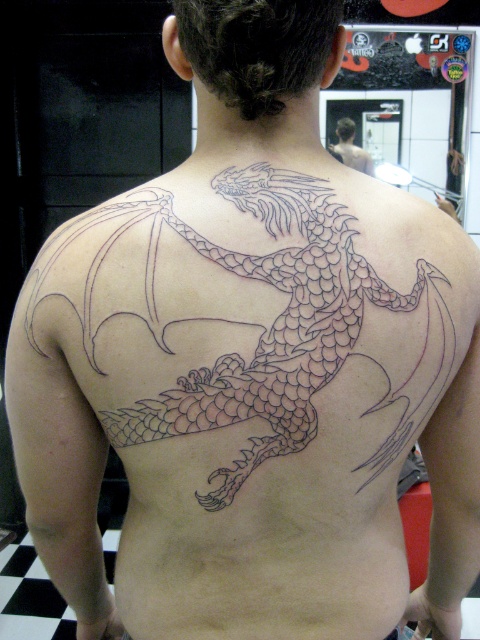
Question: Which object is closer to the camera taking this photo?

Choices:
 (A) black ink dragon at upper center
 (B) black line art dragon at center

Answer: (B)

Question: Does black line art dragon at center have a larger size compared to black ink dragon at upper center?

Choices:
 (A) no
 (B) yes

Answer: (B)

Question: Observing the image, what is the correct spatial positioning of black line art dragon at center in reference to black ink dragon at upper center?

Choices:
 (A) left
 (B) right

Answer: (A)

Question: Which point is farther from the camera taking this photo?

Choices:
 (A) (372, 170)
 (B) (192, 376)

Answer: (A)

Question: Which of the following is the farthest from the observer?

Choices:
 (A) (355, 147)
 (B) (428, 294)

Answer: (A)

Question: In this image, where is black line art dragon at center located relative to black ink dragon at upper center?

Choices:
 (A) left
 (B) right

Answer: (A)